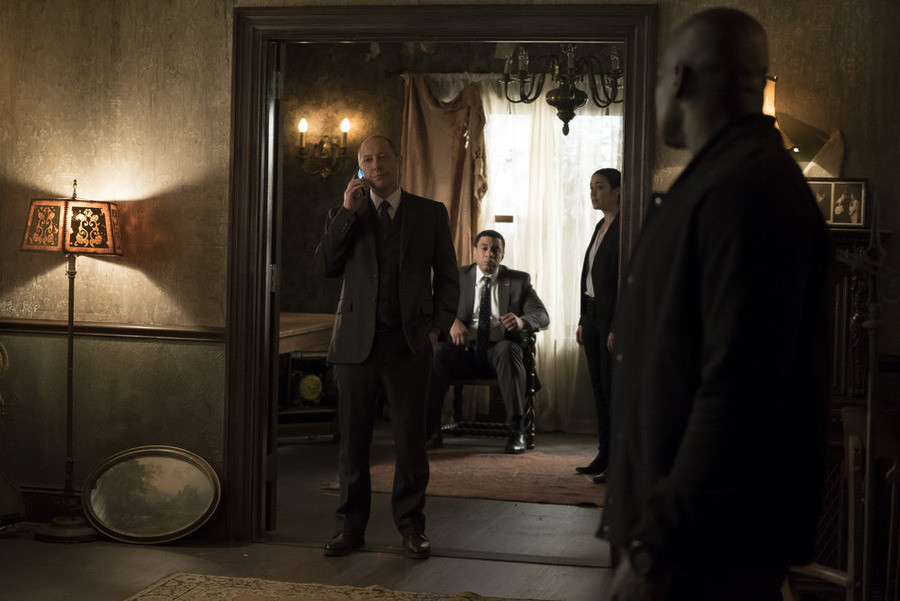
Find the location of a particular element. This screenshot has height=601, width=900. carpet is located at coordinates (524, 477).